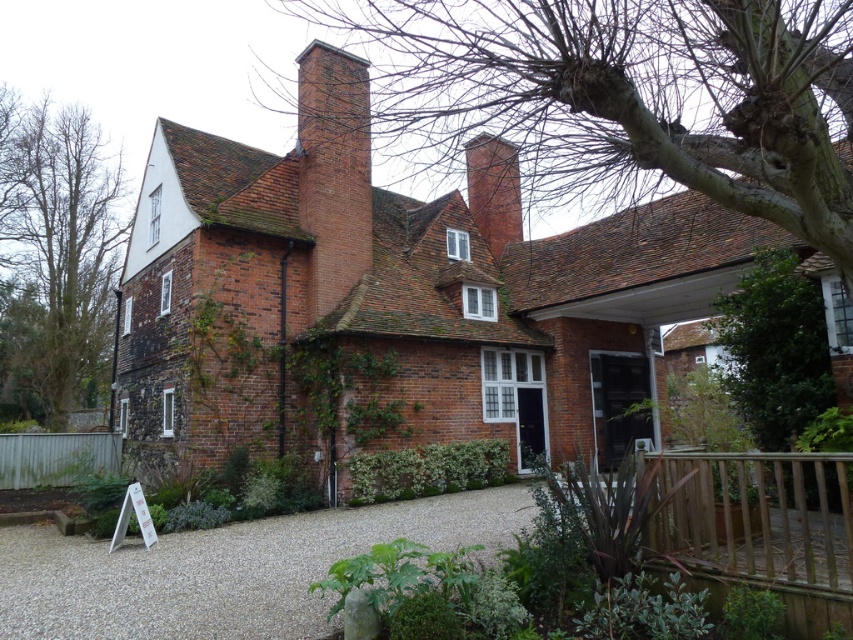
You are standing in front of the traditional brick house and want to take a photo of the brown leafless tree at left. Where should you position yourself to capture the tree in the frame?

The brown leafless tree at left is located at point (55,259), so you should position yourself in front of the traditional brick house and aim your camera towards the left side to include the tree in the frame.

You are standing in front of the house and notice a brown leafless tree at left and a brick chimney at center. Which object is closer to you?

The brown leafless tree at left is closer to you because the brick chimney at center is behind it.